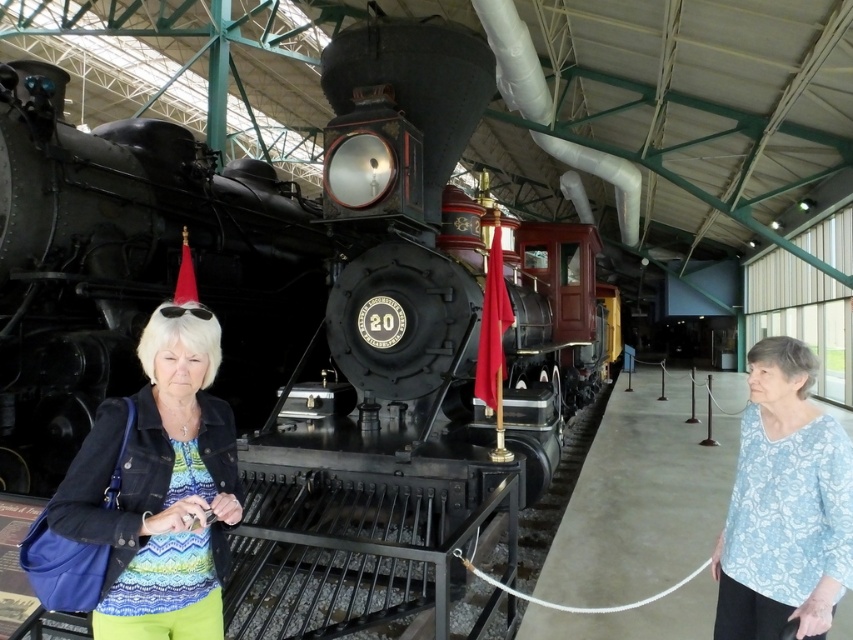
Where is `denim jacket at center`? Image resolution: width=853 pixels, height=640 pixels. denim jacket at center is located at coordinates (160, 486).

Is point (190, 326) positioned behind point (839, 557)?

That is False.

Where is `denim jacket at center`? Image resolution: width=853 pixels, height=640 pixels. denim jacket at center is located at coordinates (160, 486).